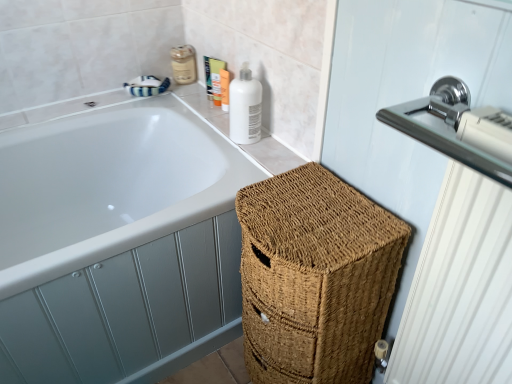
Find the location of a particular element. matte plastic tube at upper center, which is counted as the 3th toiletry, starting from the right is located at coordinates (208, 77).

Image resolution: width=512 pixels, height=384 pixels. I want to click on matte orange tube at upper center, which is the 2th toiletry in right-to-left order, so click(216, 79).

The width and height of the screenshot is (512, 384). What do you see at coordinates (224, 89) in the screenshot?
I see `matte white lotion at upper right, the 1th toiletry from the right` at bounding box center [224, 89].

Identify the location of matte beige lotion at upper center, the fourth toiletry positioned from the right. (183, 64).

Where is `polished chrome radiator at upper right`? This screenshot has height=384, width=512. polished chrome radiator at upper right is located at coordinates (460, 251).

Considering the sizes of objects matte beige lotion at upper center, the fourth toiletry positioned from the right, and matte orange tube at upper center, which is the 2th toiletry in right-to-left order, in the image provided, who is bigger, matte beige lotion at upper center, the fourth toiletry positioned from the right, or matte orange tube at upper center, which is the 2th toiletry in right-to-left order,?

Bigger between the two is matte beige lotion at upper center, the fourth toiletry positioned from the right.

Considering the points (177, 79) and (218, 95), which point is behind, point (177, 79) or point (218, 95)?

The point (177, 79) is farther from the camera.

Considering the positions of objects matte beige lotion at upper center, the 1th toiletry when ordered from left to right, and matte orange tube at upper center, which is the 2th toiletry in right-to-left order, in the image provided, who is more to the right, matte beige lotion at upper center, the 1th toiletry when ordered from left to right, or matte orange tube at upper center, which is the 2th toiletry in right-to-left order,?

matte orange tube at upper center, which is the 2th toiletry in right-to-left order, is more to the right.

Is there a large distance between matte beige lotion at upper center, the fourth toiletry positioned from the right, and matte orange tube at upper center, the third toiletry positioned from the left?

They are positioned close to each other.

Is white glossy bathtub at upper left completely or partially outside of matte orange tube at upper center, the third toiletry positioned from the left?

Indeed, white glossy bathtub at upper left is completely outside matte orange tube at upper center, the third toiletry positioned from the left.

The width and height of the screenshot is (512, 384). Identify the location of the 2nd toiletry positioned above the white glossy bathtub at upper left (from the image's perspective). (216, 79).

Considering the relative sizes of white glossy bathtub at upper left and matte orange tube at upper center, which is the 2th toiletry in right-to-left order, in the image provided, is white glossy bathtub at upper left bigger than matte orange tube at upper center, which is the 2th toiletry in right-to-left order,?

Correct, white glossy bathtub at upper left is larger in size than matte orange tube at upper center, which is the 2th toiletry in right-to-left order.

Is white glossy bathtub at upper left far from matte orange tube at upper center, the third toiletry positioned from the left?

That's not correct — white glossy bathtub at upper left is a little close to matte orange tube at upper center, the third toiletry positioned from the left.

From a real-world perspective, is white glossy bottle at upper right positioned under matte orange tube at upper center, which is the 2th toiletry in right-to-left order, based on gravity?

Actually, white glossy bottle at upper right is physically above matte orange tube at upper center, which is the 2th toiletry in right-to-left order, in the real world.

Is white glossy bottle at upper right at the right side of matte orange tube at upper center, which is the 2th toiletry in right-to-left order?

Yes.

Does point (253, 96) lie in front of point (220, 81)?

Yes.

In terms of height, does white glossy bottle at upper right look taller or shorter compared to matte orange tube at upper center, the third toiletry positioned from the left?

Considering their sizes, white glossy bottle at upper right has more height than matte orange tube at upper center, the third toiletry positioned from the left.

Considering the points (384, 286) and (174, 74), which point is in front, point (384, 286) or point (174, 74)?

The point (384, 286) is in front.

From a real-world perspective, which object stands above the other?

In real-world perspective, matte beige lotion at upper center, the fourth toiletry positioned from the right, is above.

Can you confirm if braided wicker basket at lower right is positioned to the left of matte beige lotion at upper center, the fourth toiletry positioned from the right?

In fact, braided wicker basket at lower right is to the right of matte beige lotion at upper center, the fourth toiletry positioned from the right.

Who is smaller, braided wicker basket at lower right or matte beige lotion at upper center, the fourth toiletry positioned from the right?

With smaller size is matte beige lotion at upper center, the fourth toiletry positioned from the right.

Considering the positions of objects chrome metallic sink at upper right and matte beige lotion at upper center, the 1th toiletry when ordered from left to right, in the image provided, who is more to the right, chrome metallic sink at upper right or matte beige lotion at upper center, the 1th toiletry when ordered from left to right,?

Positioned to the right is chrome metallic sink at upper right.

Is chrome metallic sink at upper right further to the viewer compared to matte beige lotion at upper center, the 1th toiletry when ordered from left to right?

No.

Is chrome metallic sink at upper right turned away from matte beige lotion at upper center, the fourth toiletry positioned from the right?

No.

Which of these two, matte white lotion at upper right, the 1th toiletry from the right, or white glossy bottle at upper right, is wider?

white glossy bottle at upper right is wider.

Is matte white lotion at upper right, arranged as the 4th toiletry when viewed from the left, completely or partially outside of white glossy bottle at upper right?

Yes, matte white lotion at upper right, arranged as the 4th toiletry when viewed from the left, is outside of white glossy bottle at upper right.

From the image's perspective, is matte white lotion at upper right, arranged as the 4th toiletry when viewed from the left, beneath white glossy bottle at upper right?

Actually, matte white lotion at upper right, arranged as the 4th toiletry when viewed from the left, appears above white glossy bottle at upper right in the image.

Could you tell me if matte white lotion at upper right, the 1th toiletry from the right, is turned towards white glossy bottle at upper right?

No, matte white lotion at upper right, the 1th toiletry from the right, is not facing towards white glossy bottle at upper right.

Consider the image. Is white glossy bottle at upper right thinner than white glossy bathtub at upper left?

Yes, white glossy bottle at upper right is thinner than white glossy bathtub at upper left.

Considering the positions of points (245, 73) and (174, 186), is point (245, 73) farther from camera compared to point (174, 186)?

No, it is not.

Between white glossy bottle at upper right and white glossy bathtub at upper left, which one has less height?

white glossy bottle at upper right.

Identify the location of toiletry that is the 2nd object located in front of the matte beige lotion at upper center, the fourth toiletry positioned from the right. This screenshot has width=512, height=384. (216, 79).

The height and width of the screenshot is (384, 512). I want to click on the 3rd toiletry directly above the white glossy bathtub at upper left (from a real-world perspective), so click(216, 79).

Looking at the image, which one is located closer to matte beige lotion at upper center, the 1th toiletry when ordered from left to right, white glossy bathtub at upper left or matte orange tube at upper center, which is the 2th toiletry in right-to-left order?

Among the two, matte orange tube at upper center, which is the 2th toiletry in right-to-left order, is located nearer to matte beige lotion at upper center, the 1th toiletry when ordered from left to right.

Looking at the image, which one is located closer to matte beige lotion at upper center, the 1th toiletry when ordered from left to right, white glossy bathtub at upper left or white glossy bottle at upper right?

white glossy bottle at upper right.

Considering their positions, is chrome metallic sink at upper right positioned closer to matte white lotion at upper right, arranged as the 4th toiletry when viewed from the left, than matte beige lotion at upper center, the 1th toiletry when ordered from left to right?

Among the two, matte beige lotion at upper center, the 1th toiletry when ordered from left to right, is located nearer to matte white lotion at upper right, arranged as the 4th toiletry when viewed from the left.

Consider the image. Which object lies further to the anchor point polished chrome radiator at upper right, matte plastic tube at upper center, which is counted as the 3th toiletry, starting from the right, or white glossy bottle at upper right?

The object further to polished chrome radiator at upper right is matte plastic tube at upper center, which is counted as the 3th toiletry, starting from the right.

From the image, which object appears to be farther from matte white lotion at upper right, arranged as the 4th toiletry when viewed from the left, matte beige lotion at upper center, the 1th toiletry when ordered from left to right, or polished chrome radiator at upper right?

polished chrome radiator at upper right is further to matte white lotion at upper right, arranged as the 4th toiletry when viewed from the left.

Estimate the real-world distances between objects in this image. Which object is closer to braided wicker basket at lower right, matte beige lotion at upper center, the fourth toiletry positioned from the right, or polished chrome radiator at upper right?

polished chrome radiator at upper right is closer to braided wicker basket at lower right.

Based on their spatial positions, is matte white lotion at upper right, arranged as the 4th toiletry when viewed from the left, or white glossy bathtub at upper left further from matte plastic tube at upper center, which is counted as the 3th toiletry, starting from the right?

white glossy bathtub at upper left is further to matte plastic tube at upper center, which is counted as the 3th toiletry, starting from the right.

Estimate the real-world distances between objects in this image. Which object is closer to white glossy bathtub at upper left, chrome metallic sink at upper right or matte beige lotion at upper center, the fourth toiletry positioned from the right?

matte beige lotion at upper center, the fourth toiletry positioned from the right, lies closer to white glossy bathtub at upper left than the other object.

The image size is (512, 384). In order to click on basket between polished chrome radiator at upper right and white glossy bottle at upper right along the z-axis in this screenshot , I will do `click(314, 277)`.

This screenshot has height=384, width=512. Find the location of `basket between polished chrome radiator at upper right and matte beige lotion at upper center, the 1th toiletry when ordered from left to right, from front to back`. basket between polished chrome radiator at upper right and matte beige lotion at upper center, the 1th toiletry when ordered from left to right, from front to back is located at coordinates (314, 277).

Find the location of `cleaning product between chrome metallic sink at upper right and matte beige lotion at upper center, the 1th toiletry when ordered from left to right, in the front-back direction`. cleaning product between chrome metallic sink at upper right and matte beige lotion at upper center, the 1th toiletry when ordered from left to right, in the front-back direction is located at coordinates (245, 107).

Locate an element on the screen. This screenshot has height=384, width=512. cleaning product between white glossy bathtub at upper left and matte orange tube at upper center, the third toiletry positioned from the left, in the front-back direction is located at coordinates (245, 107).